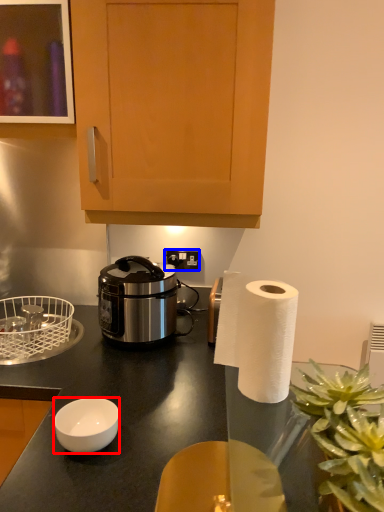
Question: Which of the following is the closest to the observer, bowl (highlighted by a red box) or power outlet (highlighted by a blue box)?

Choices:
 (A) bowl
 (B) power outlet

Answer: (A)